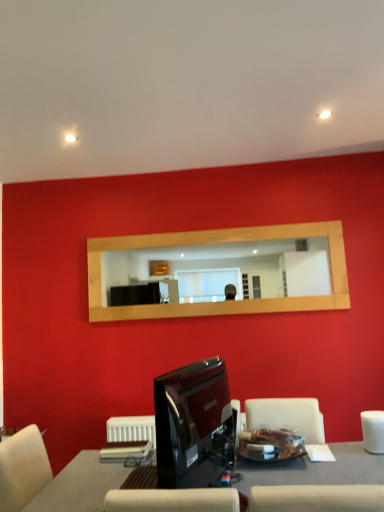
Question: From their relative heights in the image, would you say wooden mirror at center is taller or shorter than glossy black monitor at lower center?

Choices:
 (A) tall
 (B) short

Answer: (A)

Question: Would you say wooden mirror at center is inside or outside glossy black monitor at lower center?

Choices:
 (A) outside
 (B) inside

Answer: (A)

Question: Considering the real-world distances, which object is closest to the glossy black monitor at lower center?

Choices:
 (A) smooth gray table at center
 (B) wooden mirror at center
 (C) white matte armchair at lower right

Answer: (A)

Question: Estimate the real-world distances between objects in this image. Which object is farther from the glossy black monitor at lower center?

Choices:
 (A) wooden mirror at center
 (B) white matte armchair at lower right
 (C) smooth gray table at center

Answer: (A)